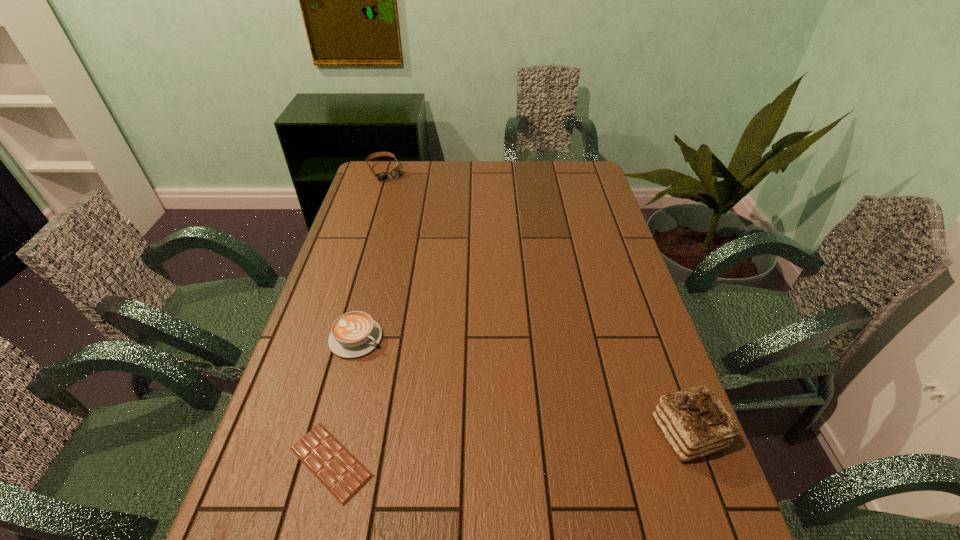
At what (x,y) coordinates should I click in order to perform the action: click on object that is positioned at the near left corner. Please return your answer as a coordinate pair (x, y). Looking at the image, I should click on (343, 475).

Image resolution: width=960 pixels, height=540 pixels. I want to click on vacant region at the far edge, so click(506, 166).

In the image, there is a desktop. At what (x,y) coordinates should I click in order to perform the action: click on vacant space at the near edge. Please return your answer as a coordinate pair (x, y). Looking at the image, I should click on (612, 481).

In the image, there is a desktop. Where is `free region at the left edge`? The height and width of the screenshot is (540, 960). free region at the left edge is located at coordinates (372, 201).

At what (x,y) coordinates should I click in order to perform the action: click on free space at the right edge. Please return your answer as a coordinate pair (x, y). Looking at the image, I should click on point(619,353).

What are the coordinates of `free space at the near left corner of the desktop` in the screenshot? It's located at (x=301, y=507).

Where is `free space at the far right corner`? free space at the far right corner is located at coordinates (564, 167).

Where is `free spot between the third nearest object and the tallest object`? The width and height of the screenshot is (960, 540). free spot between the third nearest object and the tallest object is located at coordinates (521, 386).

The height and width of the screenshot is (540, 960). Find the location of `free space that is in between the chocolate bar and the second farthest object`. free space that is in between the chocolate bar and the second farthest object is located at coordinates (344, 400).

You are a GUI agent. You are given a task and a screenshot of the screen. Output one action in this format:
    pyautogui.click(x=<x>, y=<y>)
    Task: Click on the empty space between the rightmost object and the shortest object
    The height and width of the screenshot is (540, 960).
    Given the screenshot: What is the action you would take?
    pyautogui.click(x=509, y=448)